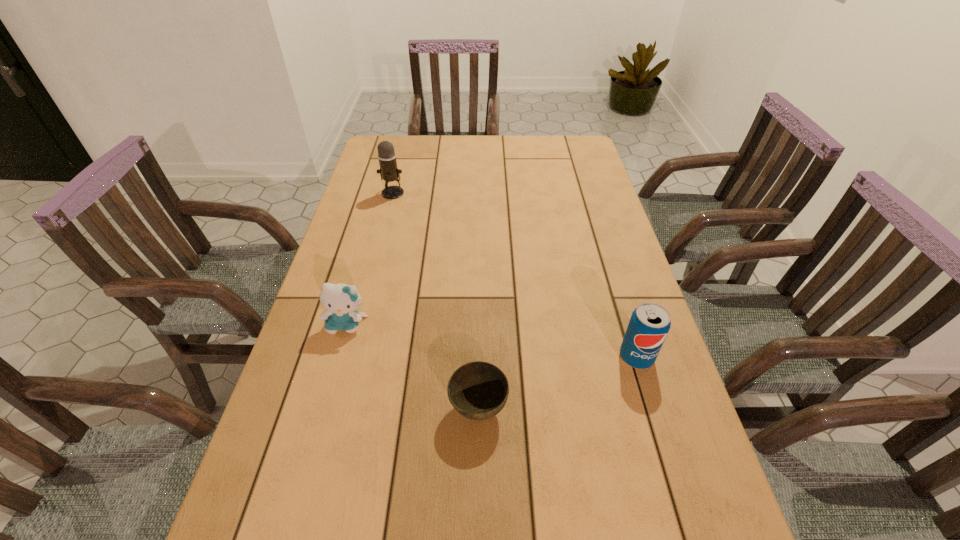
Find the location of a particular element. The width and height of the screenshot is (960, 540). the farthest object is located at coordinates (389, 172).

At what (x,y) coordinates should I click in order to perform the action: click on microphone. Please return your answer as a coordinate pair (x, y). Looking at the image, I should click on (389, 172).

This screenshot has height=540, width=960. Identify the location of soda can. (649, 324).

Where is `the third farthest object`? Image resolution: width=960 pixels, height=540 pixels. the third farthest object is located at coordinates (649, 324).

Identify the location of the second farthest object. (342, 301).

The height and width of the screenshot is (540, 960). Identify the location of the second object from right to left. (478, 390).

Find the location of a particular element. the shortest object is located at coordinates (478, 390).

The image size is (960, 540). In order to click on free region located 0.270m on the back of the microphone in this screenshot , I will do `click(404, 149)`.

At what (x,y) coordinates should I click in order to perform the action: click on free space located 0.210m on the left of the second nearest object. Please return your answer as a coordinate pair (x, y). This screenshot has width=960, height=540. Looking at the image, I should click on (527, 357).

Locate an element on the screen. This screenshot has height=540, width=960. free space located on the face of the kitten is located at coordinates (299, 496).